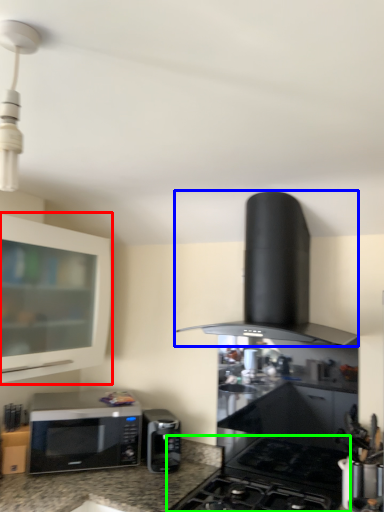
Question: Which object is positioned closest to cabinetry (highlighted by a red box)? Select from kitchen appliance (highlighted by a blue box) and gas stove (highlighted by a green box).

Choices:
 (A) kitchen appliance
 (B) gas stove

Answer: (A)